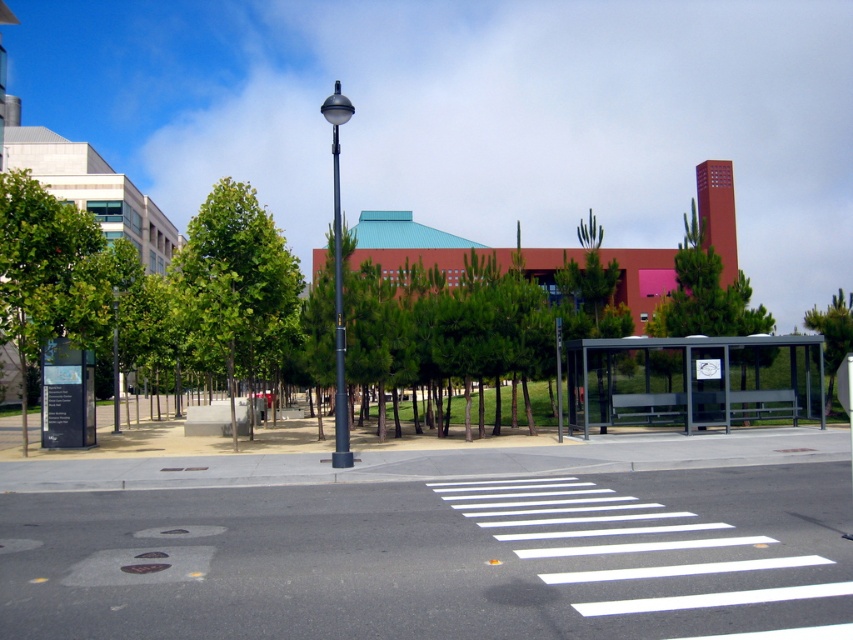
Question: Among these objects, which one is farthest from the camera?

Choices:
 (A) metallic pole at left
 (B) white painted crosswalk at center

Answer: (A)

Question: Is white painted crosswalk at center to the right of metallic pole at left from the viewer's perspective?

Choices:
 (A) no
 (B) yes

Answer: (B)

Question: Can you confirm if white asphalt crosswalk at center is thinner than polished metal streetlight at center-left?

Choices:
 (A) yes
 (B) no

Answer: (B)

Question: Based on their relative distances, which object is nearer to the polished metal streetlight at center-left?

Choices:
 (A) metallic pole at left
 (B) green leafy tree at left
 (C) white asphalt crosswalk at center

Answer: (B)

Question: Considering the relative positions of green leafy tree at upper right and metallic pole at left in the image provided, where is green leafy tree at upper right located with respect to metallic pole at left?

Choices:
 (A) above
 (B) below

Answer: (A)

Question: Which of the following is the farthest from the observer?

Choices:
 (A) (329, 100)
 (B) (259, 216)
 (C) (115, 360)

Answer: (C)